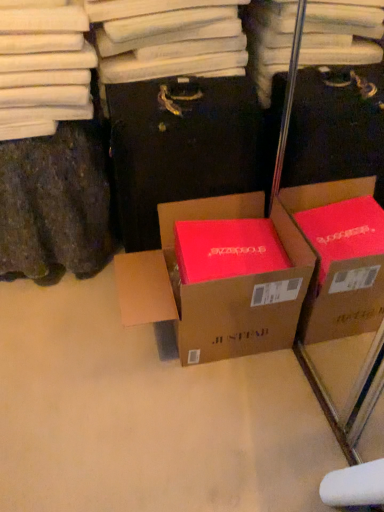
The width and height of the screenshot is (384, 512). I want to click on free space in front of matte cardboard box at center, so click(200, 436).